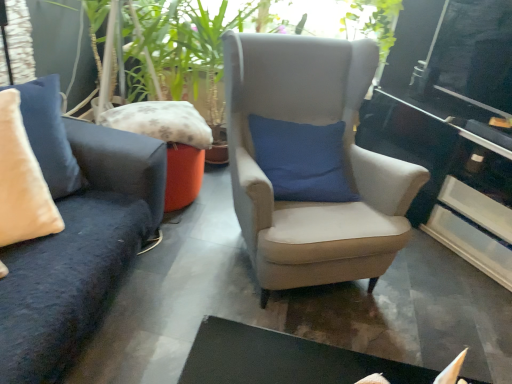
How much space does fluffy fabric pillow at center, positioned as the first pillow in back-to-front order, occupy horizontally?

13.49 inches.

Find the location of a particular element. The image size is (512, 384). glossy black table at right is located at coordinates (450, 179).

Can we say suede beige armchair at center lies outside glossy black table at right?

Indeed, suede beige armchair at center is completely outside glossy black table at right.

Which point is more distant from viewer, (307,217) or (441,120)?

Point (441,120)

Could you tell me if suede beige armchair at center is turned towards glossy black table at right?

No, suede beige armchair at center is not facing towards glossy black table at right.

Between suede beige armchair at center and glossy black table at right, which one is positioned in front?

suede beige armchair at center is more forward.

Are glossy black table at right and fluffy fabric pillow at center, positioned as the first pillow in back-to-front order, located far from each other?

Indeed, glossy black table at right is not near fluffy fabric pillow at center, positioned as the first pillow in back-to-front order.

Is glossy black table at right thinner than fluffy fabric pillow at center, positioned as the first pillow in back-to-front order?

Incorrect, the width of glossy black table at right is not less than that of fluffy fabric pillow at center, positioned as the first pillow in back-to-front order.

From a real-world perspective, relative to fluffy fabric pillow at center, placed as the second pillow when sorted from front to back, is glossy black table at right vertically above or below?

glossy black table at right is below fluffy fabric pillow at center, placed as the second pillow when sorted from front to back.

Can you confirm if glossy black table at right is smaller than fluffy fabric pillow at center, positioned as the first pillow in back-to-front order?

No, glossy black table at right is not smaller than fluffy fabric pillow at center, positioned as the first pillow in back-to-front order.

From the suede beige armchair at center, count the 2nd pillow to the left and point to it. Please provide its 2D coordinates.

[(49, 135)]

Considering the relative sizes of suede beige armchair at center and beige velvet pillow at left, acting as the 2th pillow starting from the back, in the image provided, is suede beige armchair at center bigger than beige velvet pillow at left, acting as the 2th pillow starting from the back,?

Correct, suede beige armchair at center is larger in size than beige velvet pillow at left, acting as the 2th pillow starting from the back.

Considering the positions of objects suede beige armchair at center and beige velvet pillow at left, the 1th pillow from the front, in the image provided, who is behind, suede beige armchair at center or beige velvet pillow at left, the 1th pillow from the front,?

suede beige armchair at center is behind.

Based on the photo, from the image's perspective, relative to beige velvet pillow at left, the 1th pillow from the front, is fluffy fabric pillow at center, placed as the second pillow when sorted from front to back, above or below?

Clearly, from the image's perspective, fluffy fabric pillow at center, placed as the second pillow when sorted from front to back, is above beige velvet pillow at left, the 1th pillow from the front.

Is fluffy fabric pillow at center, positioned as the first pillow in back-to-front order, placed right next to beige velvet pillow at left, the 1th pillow from the front?

fluffy fabric pillow at center, positioned as the first pillow in back-to-front order, and beige velvet pillow at left, the 1th pillow from the front, are clearly separated.

Is point (154, 133) closer or farther from the camera than point (59, 148)?

Point (154, 133) is farther from the camera than point (59, 148).

From a real-world perspective, is fluffy fabric pillow at center, placed as the second pillow when sorted from front to back, located higher than beige velvet pillow at left, the 1th pillow from the front?

No, from a real-world perspective, fluffy fabric pillow at center, placed as the second pillow when sorted from front to back, is not above beige velvet pillow at left, the 1th pillow from the front.

Can we say beige velvet pillow at left, the 1th pillow from the front, lies outside glossy black table at right?

beige velvet pillow at left, the 1th pillow from the front, is positioned outside glossy black table at right.

How many degrees apart are the facing directions of beige velvet pillow at left, acting as the 2th pillow starting from the back, and glossy black table at right?

74.6 degrees.

Where is `pillow in front of the glossy black table at right`? Image resolution: width=512 pixels, height=384 pixels. pillow in front of the glossy black table at right is located at coordinates (49, 135).

Looking at this image, could you tell me if beige velvet pillow at left, the 1th pillow from the front, is turned towards glossy black table at right?

No, beige velvet pillow at left, the 1th pillow from the front, is not oriented towards glossy black table at right.

In terms of size, does suede beige armchair at center appear bigger or smaller than fluffy fabric pillow at center, positioned as the first pillow in back-to-front order?

Clearly, suede beige armchair at center is larger in size than fluffy fabric pillow at center, positioned as the first pillow in back-to-front order.

From a real-world perspective, relative to fluffy fabric pillow at center, placed as the second pillow when sorted from front to back, is suede beige armchair at center vertically above or below?

suede beige armchair at center is above fluffy fabric pillow at center, placed as the second pillow when sorted from front to back.

Is point (244, 157) closer or farther from the camera than point (148, 132)?

Point (244, 157) is positioned closer to the camera compared to point (148, 132).

Is beige velvet pillow at left, the 1th pillow from the front, oriented away from fluffy fabric pillow at center, placed as the second pillow when sorted from front to back?

No, beige velvet pillow at left, the 1th pillow from the front,'s orientation is not away from fluffy fabric pillow at center, placed as the second pillow when sorted from front to back.

At what (x,y) coordinates should I click in order to perform the action: click on pillow above the fluffy fabric pillow at center, placed as the second pillow when sorted from front to back (from a real-world perspective). Please return your answer as a coordinate pair (x, y). The width and height of the screenshot is (512, 384). Looking at the image, I should click on pos(49,135).

From a real-world perspective, between beige velvet pillow at left, acting as the 2th pillow starting from the back, and fluffy fabric pillow at center, placed as the second pillow when sorted from front to back, who is vertically higher?

beige velvet pillow at left, acting as the 2th pillow starting from the back.

Does point (35, 117) come in front of point (142, 109)?

Yes, point (35, 117) is in front of point (142, 109).

You are a GUI agent. You are given a task and a screenshot of the screen. Output one action in this format:
    pyautogui.click(x=<x>, y=<y>)
    Task: Click on the chair above the glossy black table at right (from a real-world perspective)
    The width and height of the screenshot is (512, 384).
    Given the screenshot: What is the action you would take?
    click(x=345, y=163)

Starting from the glossy black table at right, which pillow is the 1st one to the left? Please provide its 2D coordinates.

[(161, 122)]

Consider the image. Estimate the real-world distances between objects in this image. Which object is closer to suede beige armchair at center, glossy black table at right or beige velvet pillow at left, acting as the 2th pillow starting from the back?

glossy black table at right lies closer to suede beige armchair at center than the other object.

Which object lies further to the anchor point glossy black table at right, beige velvet pillow at left, the 1th pillow from the front, or fluffy fabric pillow at center, placed as the second pillow when sorted from front to back?

beige velvet pillow at left, the 1th pillow from the front.

Estimate the real-world distances between objects in this image. Which object is closer to fluffy fabric pillow at center, placed as the second pillow when sorted from front to back, glossy black table at right or suede beige armchair at center?

suede beige armchair at center.

Which object lies further to the anchor point suede beige armchair at center, beige velvet pillow at left, acting as the 2th pillow starting from the back, or glossy black table at right?

Among the two, beige velvet pillow at left, acting as the 2th pillow starting from the back, is located further to suede beige armchair at center.

From the image, which object appears to be farther from glossy black table at right, fluffy fabric pillow at center, placed as the second pillow when sorted from front to back, or suede beige armchair at center?

Among the two, fluffy fabric pillow at center, placed as the second pillow when sorted from front to back, is located further to glossy black table at right.

When comparing their distances from suede beige armchair at center, does fluffy fabric pillow at center, placed as the second pillow when sorted from front to back, or glossy black table at right seem closer?

fluffy fabric pillow at center, placed as the second pillow when sorted from front to back, is closer to suede beige armchair at center.

Which object lies nearer to the anchor point beige velvet pillow at left, acting as the 2th pillow starting from the back, glossy black table at right or fluffy fabric pillow at center, placed as the second pillow when sorted from front to back?

Among the two, fluffy fabric pillow at center, placed as the second pillow when sorted from front to back, is located nearer to beige velvet pillow at left, acting as the 2th pillow starting from the back.

Looking at the image, which one is located further to suede beige armchair at center, beige velvet pillow at left, acting as the 2th pillow starting from the back, or fluffy fabric pillow at center, placed as the second pillow when sorted from front to back?

The object further to suede beige armchair at center is beige velvet pillow at left, acting as the 2th pillow starting from the back.

This screenshot has height=384, width=512. Find the location of `chair situated between fluffy fabric pillow at center, placed as the second pillow when sorted from front to back, and glossy black table at right from left to right`. chair situated between fluffy fabric pillow at center, placed as the second pillow when sorted from front to back, and glossy black table at right from left to right is located at coordinates (345, 163).

You are a GUI agent. You are given a task and a screenshot of the screen. Output one action in this format:
    pyautogui.click(x=<x>, y=<y>)
    Task: Click on the pillow between beige velvet pillow at left, the 1th pillow from the front, and suede beige armchair at center
    Image resolution: width=512 pixels, height=384 pixels.
    Given the screenshot: What is the action you would take?
    pyautogui.click(x=161, y=122)

Where is `chair located between beige velvet pillow at left, acting as the 2th pillow starting from the back, and glossy black table at right in the left-right direction`? chair located between beige velvet pillow at left, acting as the 2th pillow starting from the back, and glossy black table at right in the left-right direction is located at coordinates (345, 163).

Image resolution: width=512 pixels, height=384 pixels. What are the coordinates of `pillow between beige velvet pillow at left, the 1th pillow from the front, and glossy black table at right, in the horizontal direction` in the screenshot? It's located at click(161, 122).